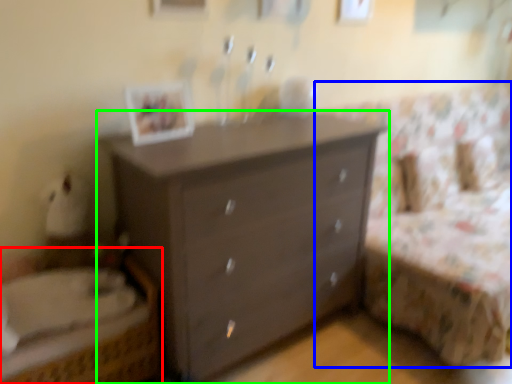
Question: Which object is positioned closest to bed (highlighted by a red box)? Select from bed frame (highlighted by a blue box) and chest of drawers (highlighted by a green box).

Choices:
 (A) bed frame
 (B) chest of drawers

Answer: (B)